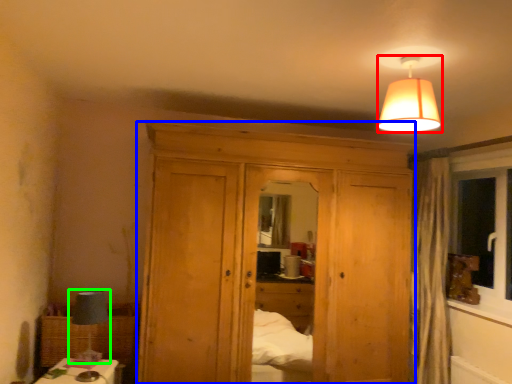
Question: Estimate the real-world distances between objects in this image. Which object is farther from lamp (highlighted by a red box), dresser (highlighted by a blue box) or table lamp (highlighted by a green box)?

Choices:
 (A) dresser
 (B) table lamp

Answer: (B)